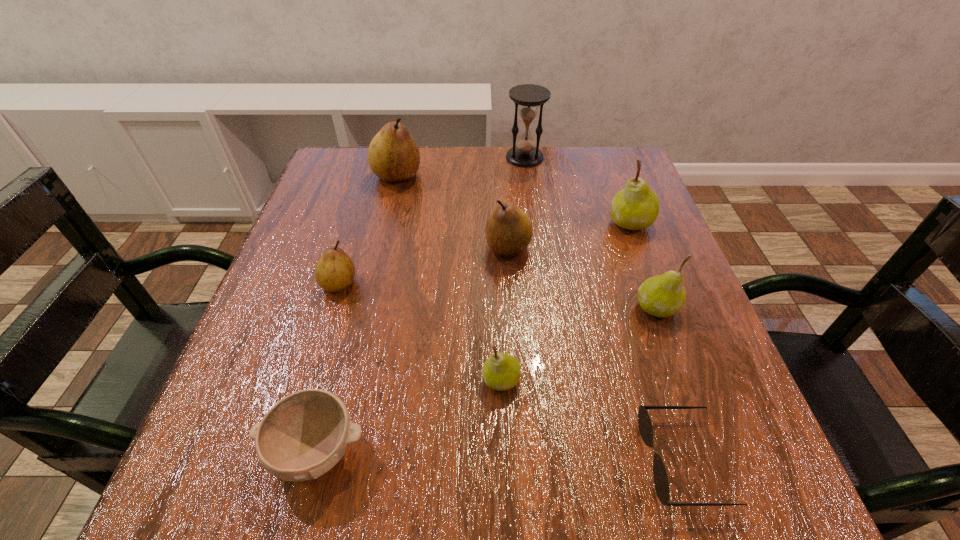
Where is `free space between the nearest green pear and the hourglass`? This screenshot has height=540, width=960. free space between the nearest green pear and the hourglass is located at coordinates (513, 268).

Identify the location of empty location between the second smallest green pear and the second biggest brown pear. Image resolution: width=960 pixels, height=540 pixels. (583, 278).

This screenshot has width=960, height=540. Find the location of `free space between the biggest green pear and the nearest green pear`. free space between the biggest green pear and the nearest green pear is located at coordinates pos(565,301).

Where is `free space between the second biggest brown pear and the biggest brown pear`? free space between the second biggest brown pear and the biggest brown pear is located at coordinates (453, 212).

Find the location of a particular element. The image size is (960, 540). vacant region between the nearest green pear and the nearest brown pear is located at coordinates (420, 332).

Where is `free space between the second farthest brown pear and the eighth tallest object`? free space between the second farthest brown pear and the eighth tallest object is located at coordinates (413, 349).

Where is `free space between the nearest pear and the second farthest brown pear`? Image resolution: width=960 pixels, height=540 pixels. free space between the nearest pear and the second farthest brown pear is located at coordinates (505, 314).

Find the location of a particular element. This screenshot has width=960, height=540. vacant space that is in between the smallest brown pear and the farthest pear is located at coordinates (368, 230).

Locate an element on the screen. The image size is (960, 540). the third closest object relative to the black sunglasses is located at coordinates (509, 230).

Identify the location of object that is the third closest one to the smallest brown pear. (393, 155).